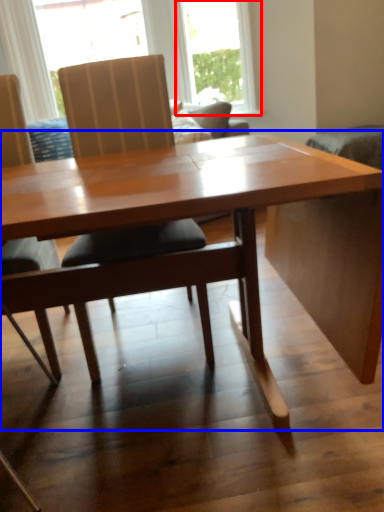
Question: Among these objects, which one is nearest to the camera, window (highlighted by a red box) or table (highlighted by a blue box)?

Choices:
 (A) window
 (B) table

Answer: (B)